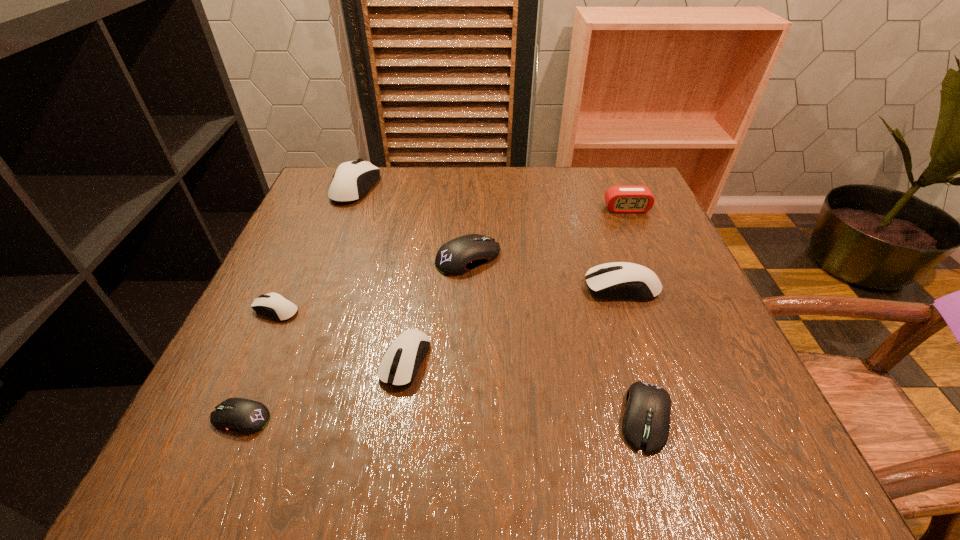
The image size is (960, 540). Find the location of `unoccupied area between the second biggest white mouse and the alarm clock`. unoccupied area between the second biggest white mouse and the alarm clock is located at coordinates (624, 248).

Where is `object that is the sixth closest to the farthest computer equipment`? object that is the sixth closest to the farthest computer equipment is located at coordinates (619, 199).

Choose which object is the nearest neighbor to the rightmost white mouse. Please provide its 2D coordinates. Your answer should be formatted as a tuple, i.e. [(x, y)], where the tuple contains the x and y coordinates of a point satisfying the conditions above.

[(458, 256)]

Locate an element on the screen. This screenshot has height=540, width=960. computer equipment that stands as the fifth closest to the smallest black computer equipment is located at coordinates (352, 180).

Locate which computer equipment is the third closest to the second biggest black computer equipment. Please provide its 2D coordinates. Your answer should be formatted as a tuple, i.e. [(x, y)], where the tuple contains the x and y coordinates of a point satisfying the conditions above.

[(458, 256)]

What are the coordinates of `white mouse that is the third nearest to the second biggest black computer equipment` in the screenshot? It's located at (274, 305).

The height and width of the screenshot is (540, 960). What are the coordinates of `the closest white mouse to the second white mouse from right to left` in the screenshot? It's located at (274, 305).

You are a GUI agent. You are given a task and a screenshot of the screen. Output one action in this format:
    pyautogui.click(x=<x>, y=<y>)
    Task: Click on the black computer equipment that is the second closest one to the leftmost black computer equipment
    
    Given the screenshot: What is the action you would take?
    pyautogui.click(x=646, y=422)

Locate an element on the screen. the second closest black computer equipment to the pink alarm clock is located at coordinates pyautogui.click(x=646, y=422).

Image resolution: width=960 pixels, height=540 pixels. Identify the location of blank area in the image that satisfies the following two spatial constraints: 1. on the back side of the farthest computer equipment; 2. on the left side of the smallest white mouse. (332, 187).